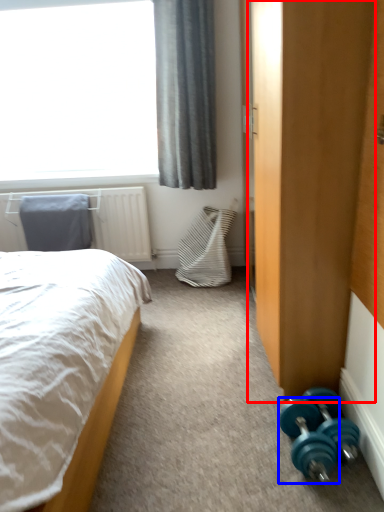
Question: Which of the following is the closest to the observer, armoire (highlighted by a red box) or dumbbell (highlighted by a blue box)?

Choices:
 (A) armoire
 (B) dumbbell

Answer: (A)